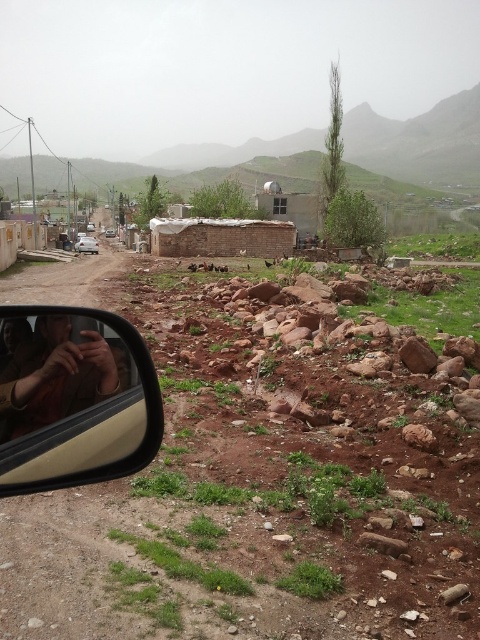
Which is above, matte beige rearview mirror at lower left or brown leather jacket at left?

Positioned higher is brown leather jacket at left.

Does matte beige rearview mirror at lower left lie behind brown leather jacket at left?

No, matte beige rearview mirror at lower left is in front of brown leather jacket at left.

Does point (9, 323) come farther from viewer compared to point (72, 397)?

That is False.

Locate an element on the screen. This screenshot has width=480, height=640. matte beige rearview mirror at lower left is located at coordinates (73, 397).

Where is `brown leather jacket at left`? brown leather jacket at left is located at coordinates (55, 371).

Can you confirm if brown leather jacket at left is positioned to the right of silver metallic car at left?

Indeed, brown leather jacket at left is positioned on the right side of silver metallic car at left.

Between point (12, 428) and point (83, 241), which one is positioned behind?

Positioned behind is point (83, 241).

Locate an element on the screen. The image size is (480, 640). brown leather jacket at left is located at coordinates point(55,371).

Which is in front, point (10, 323) or point (75, 243)?

Point (10, 323) is more forward.

Is point (7, 444) in front of point (96, 253)?

Yes, point (7, 444) is closer to viewer.

Is point (20, 461) positioned before point (83, 237)?

Yes.

Locate an element on the screen. The height and width of the screenshot is (640, 480). matte beige rearview mirror at lower left is located at coordinates (73, 397).